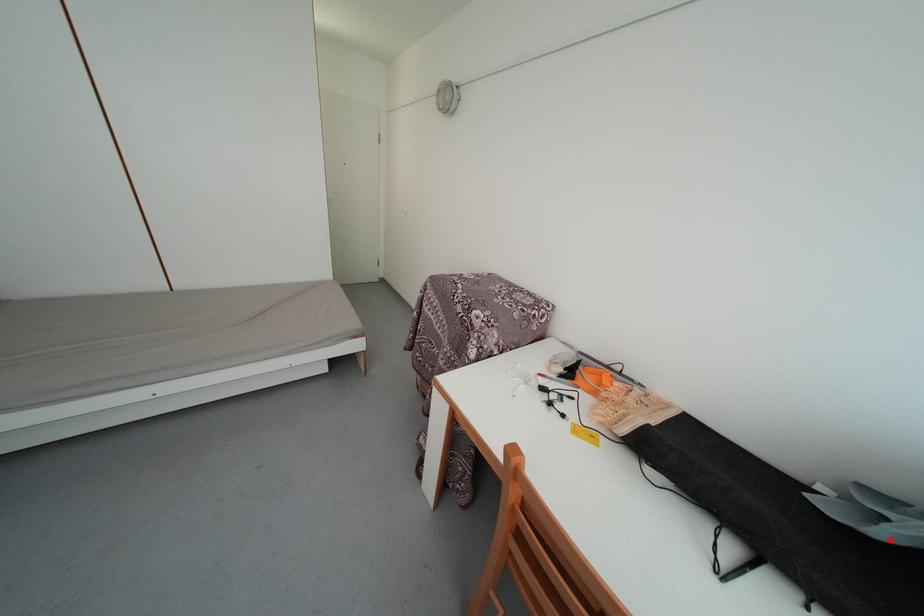
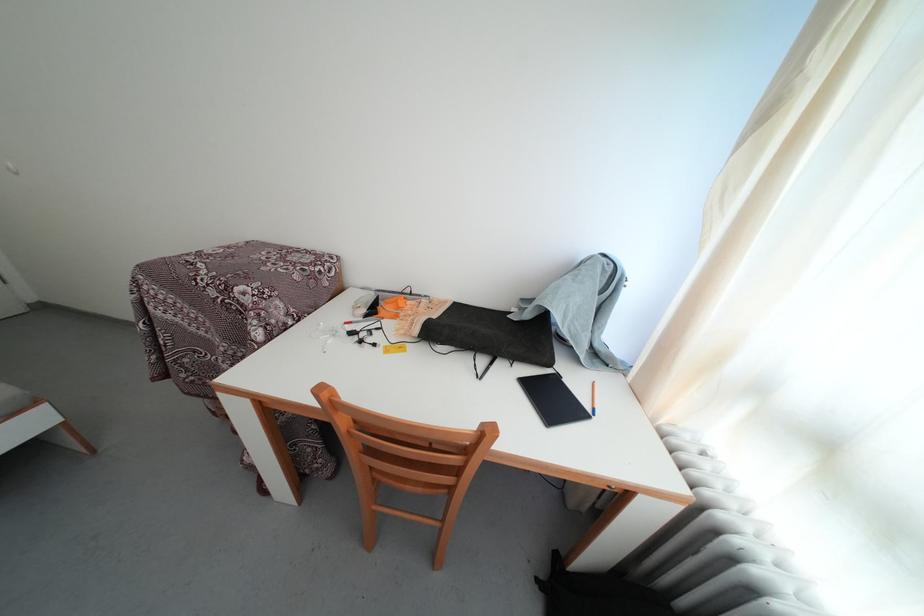
Question: I am providing you with two images of the same scene from different viewpoints. Image1 has a red point marked. In image2, the corresponding 3D location appears at what relative position? Reply with the corresponding letter.

Choices:
 (A) Closer
 (B) Farther

Answer: (A)